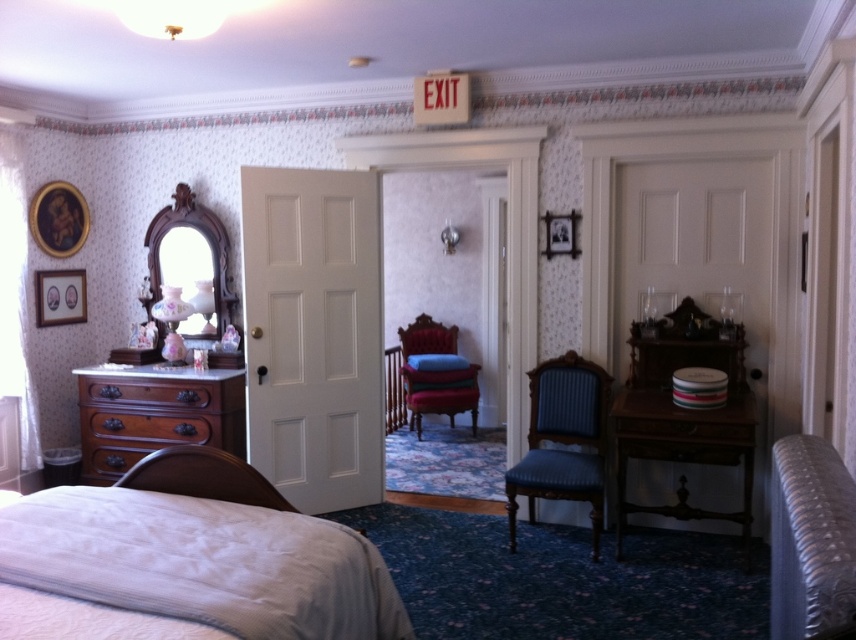
Is light gray fabric bed at lower left in front of blue fabric chair at center?

Yes, light gray fabric bed at lower left is in front of blue fabric chair at center.

Find the location of a particular element. The height and width of the screenshot is (640, 856). light gray fabric bed at lower left is located at coordinates (201, 552).

Can you confirm if mahogany wooden dresser at left is shorter than blue fabric chair at center?

Indeed, mahogany wooden dresser at left has a lesser height compared to blue fabric chair at center.

How distant is mahogany wooden dresser at left from blue fabric chair at center?

mahogany wooden dresser at left and blue fabric chair at center are 7.24 feet apart.

The height and width of the screenshot is (640, 856). What are the coordinates of `mahogany wooden dresser at left` in the screenshot? It's located at (155, 413).

Is mahogany wooden dresser at left to the left of velvet red chair at center from the viewer's perspective?

Yes, mahogany wooden dresser at left is to the left of velvet red chair at center.

Can you confirm if mahogany wooden dresser at left is positioned above velvet red chair at center?

Actually, mahogany wooden dresser at left is below velvet red chair at center.

I want to click on mahogany wooden dresser at left, so click(155, 413).

Find the location of a particular element. This screenshot has width=856, height=640. mahogany wooden dresser at left is located at coordinates (155, 413).